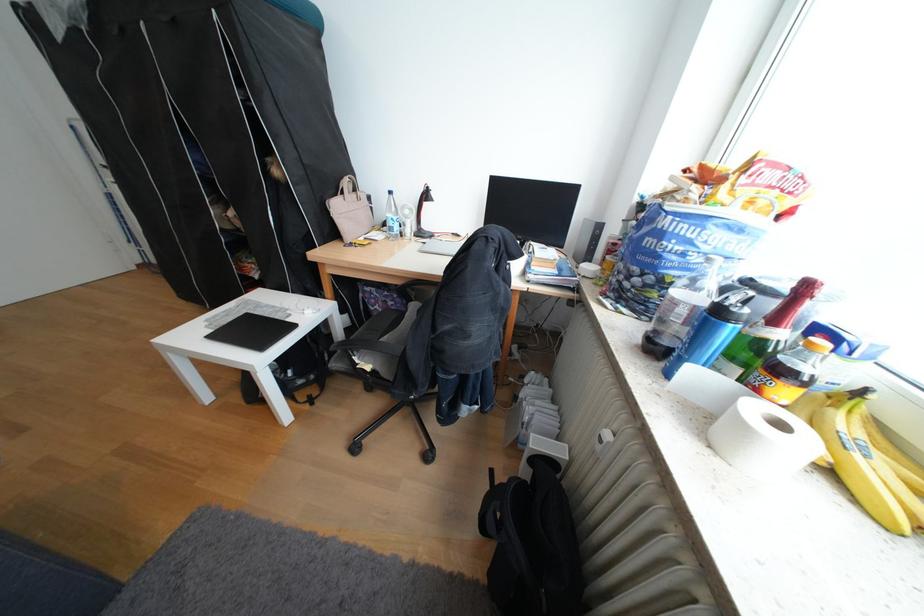
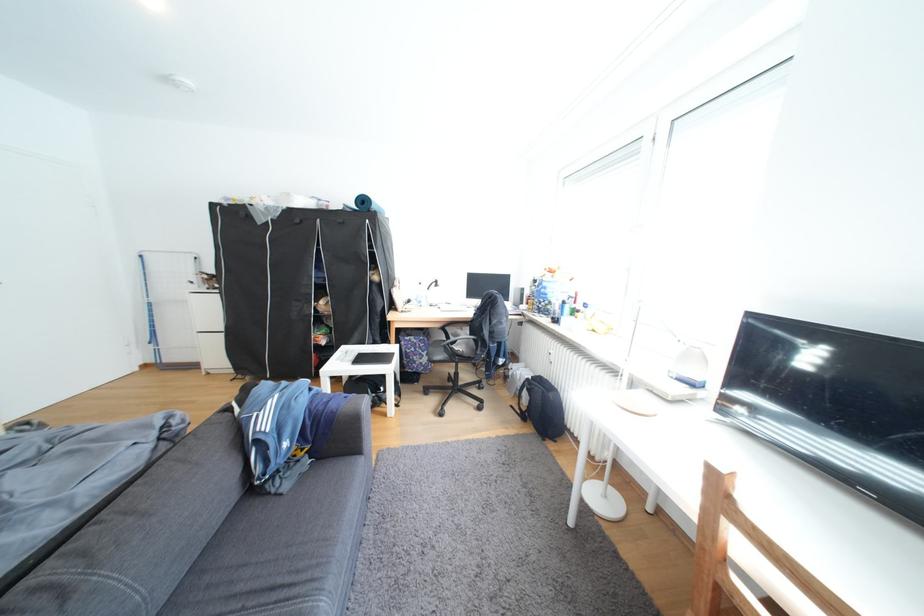
In the second image, find the point that corresponds to point 355,193 in the first image.

(408, 286)